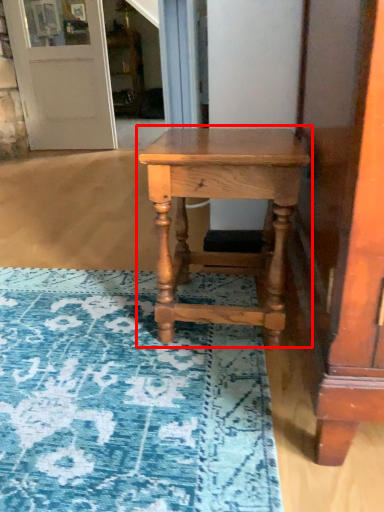
Question: From the image's perspective, where is table (annotated by the red box) located in relation to door in the image?

Choices:
 (A) above
 (B) below

Answer: (B)